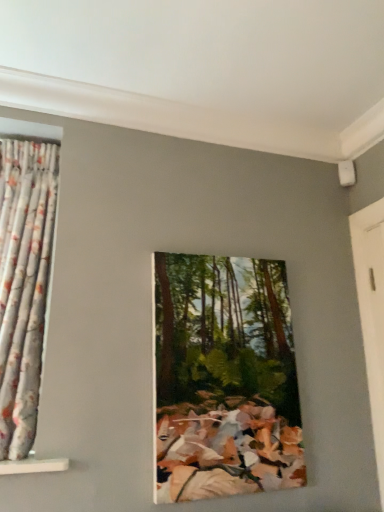
Question: Considering the relative sizes of floral fabric curtain at left and oil painting of forest at center in the image provided, is floral fabric curtain at left wider than oil painting of forest at center?

Choices:
 (A) yes
 (B) no

Answer: (A)

Question: Is floral fabric curtain at left positioned beyond the bounds of oil painting of forest at center?

Choices:
 (A) no
 (B) yes

Answer: (B)

Question: Considering the relative sizes of floral fabric curtain at left and oil painting of forest at center in the image provided, is floral fabric curtain at left taller than oil painting of forest at center?

Choices:
 (A) no
 (B) yes

Answer: (B)

Question: Does floral fabric curtain at left have a larger size compared to oil painting of forest at center?

Choices:
 (A) yes
 (B) no

Answer: (A)

Question: Does floral fabric curtain at left lie in front of oil painting of forest at center?

Choices:
 (A) no
 (B) yes

Answer: (B)

Question: From a real-world perspective, is floral fabric curtain at left over oil painting of forest at center?

Choices:
 (A) yes
 (B) no

Answer: (A)

Question: From the image's perspective, is white wooden door at right over floral fabric curtain at left?

Choices:
 (A) yes
 (B) no

Answer: (B)

Question: Is white wooden door at right shorter than floral fabric curtain at left?

Choices:
 (A) no
 (B) yes

Answer: (B)

Question: Does white wooden door at right appear on the right side of floral fabric curtain at left?

Choices:
 (A) yes
 (B) no

Answer: (A)

Question: Does white wooden door at right appear on the left side of floral fabric curtain at left?

Choices:
 (A) no
 (B) yes

Answer: (A)

Question: Is white wooden door at right wider than floral fabric curtain at left?

Choices:
 (A) yes
 (B) no

Answer: (B)

Question: Is white wooden door at right directly adjacent to floral fabric curtain at left?

Choices:
 (A) yes
 (B) no

Answer: (B)

Question: Is oil painting of forest at center shorter than white wooden door at right?

Choices:
 (A) yes
 (B) no

Answer: (A)